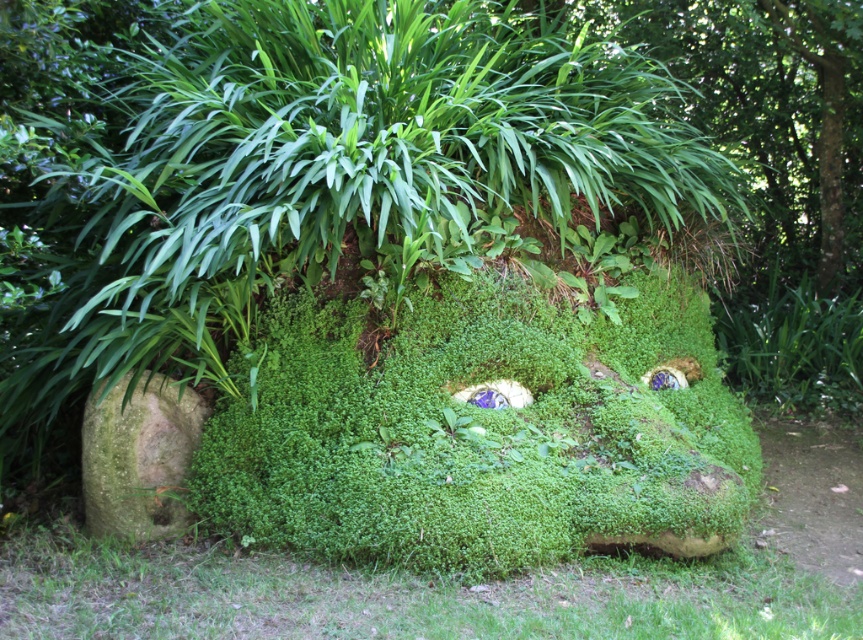
Question: Among these points, which one is farthest from the camera?

Choices:
 (A) (156, 474)
 (B) (262, 552)

Answer: (A)

Question: Can you confirm if green mossy rock at lower center is positioned to the left of green mossy rock at lower left?

Choices:
 (A) no
 (B) yes

Answer: (A)

Question: Can you confirm if green mossy rock at lower center is bigger than green mossy rock at lower left?

Choices:
 (A) yes
 (B) no

Answer: (A)

Question: Does green mossy rock at lower center appear on the right side of green mossy rock at lower left?

Choices:
 (A) yes
 (B) no

Answer: (A)